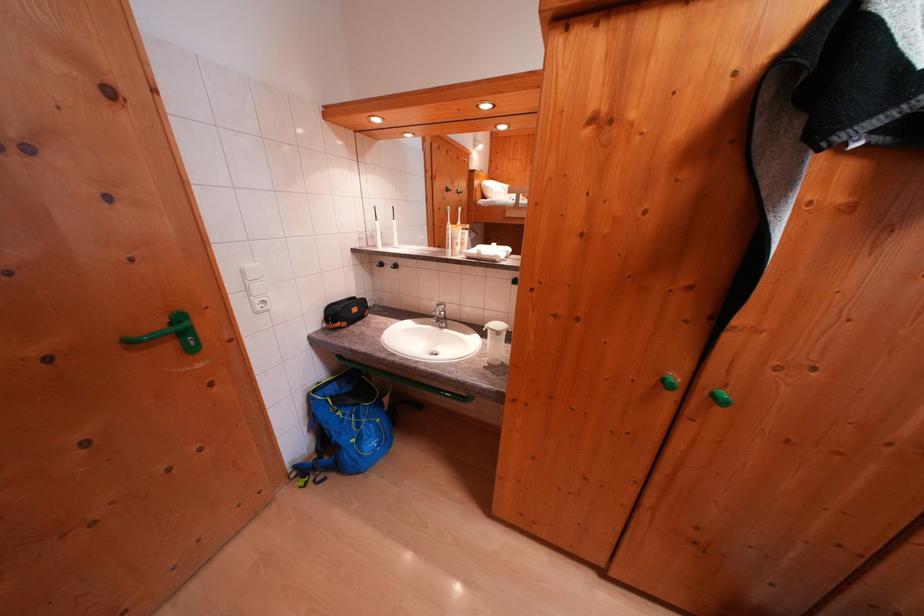
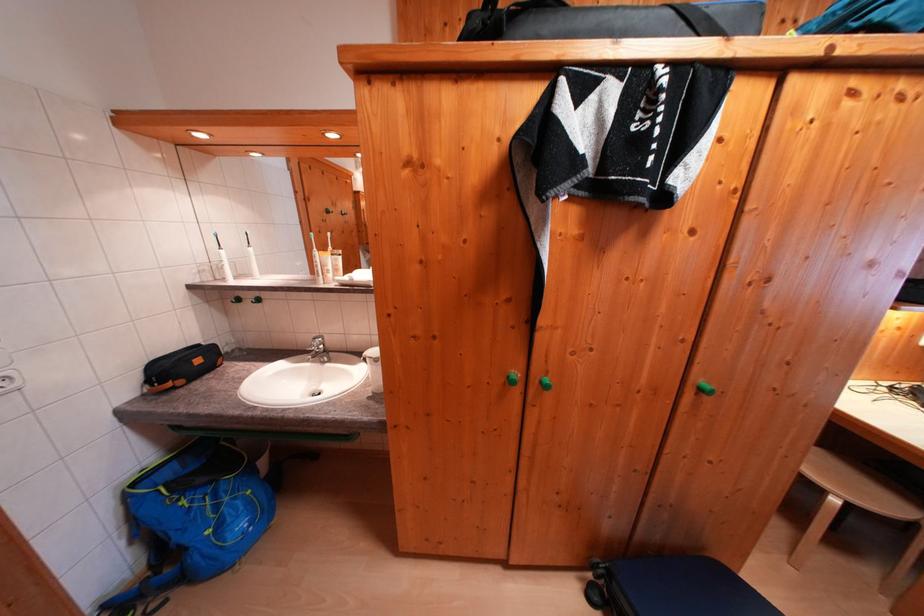
Find the pixel in the second image that matches the point at 322,395 in the first image.

(142, 488)